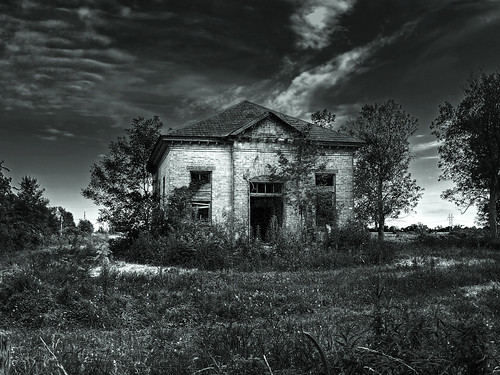
You are a GUI agent. You are given a task and a screenshot of the screen. Output one action in this format:
    pyautogui.click(x=<x>, y=<y>)
    Task: Click on the small rectangular window on right
    This screenshot has height=375, width=500.
    Given the screenshot: What is the action you would take?
    pyautogui.click(x=329, y=180)